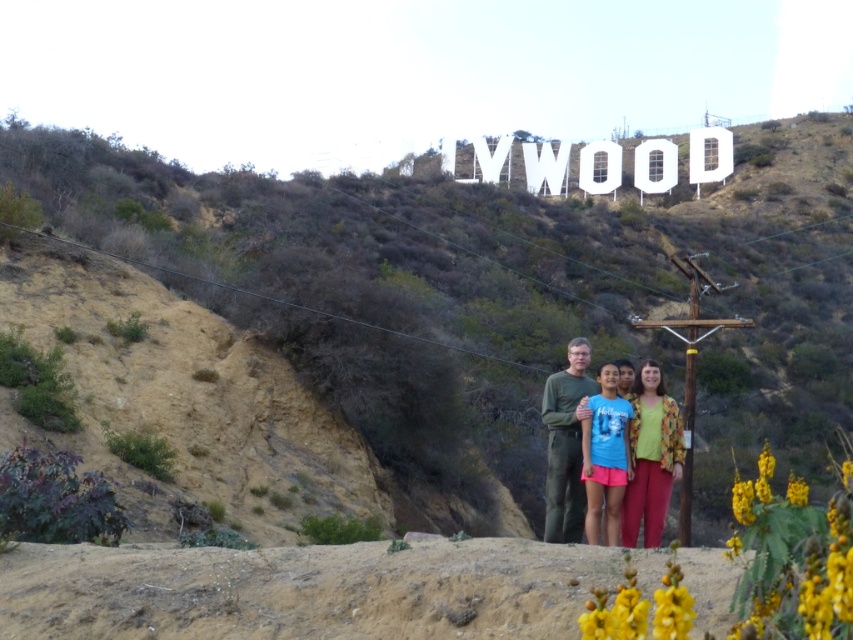
Question: Among these points, which one is farthest from the camera?

Choices:
 (A) (569, 456)
 (B) (653, 401)
 (C) (383, 308)

Answer: (C)

Question: Is floral-patterned blouse at center smaller than matte green shirt at center?

Choices:
 (A) yes
 (B) no

Answer: (A)

Question: Is matte green shirt at center above green matte shirt at center?

Choices:
 (A) no
 (B) yes

Answer: (B)

Question: Can you confirm if dried grass at upper center is thinner than matte green shirt at center?

Choices:
 (A) yes
 (B) no

Answer: (B)

Question: Which point appears farthest from the camera in this image?

Choices:
 (A) (666, 404)
 (B) (561, 541)
 (C) (590, 516)
 (D) (563, 538)

Answer: (A)

Question: Among these points, which one is nearest to the camera?

Choices:
 (A) (630, 518)
 (B) (613, 392)

Answer: (A)